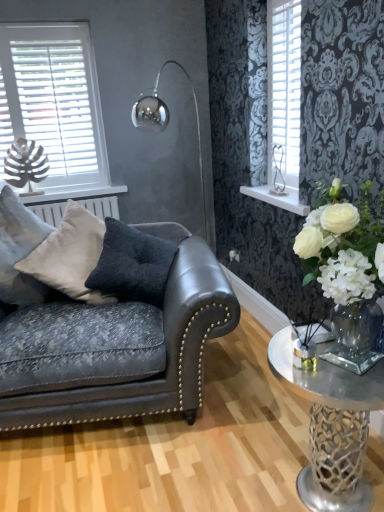
The height and width of the screenshot is (512, 384). I want to click on free point in front of clear glass vase at lower right, so click(x=367, y=377).